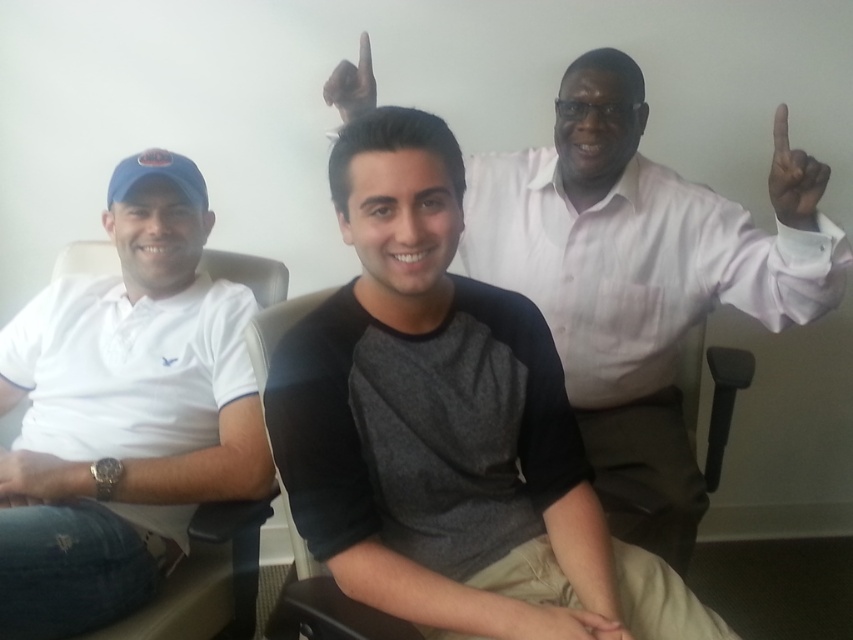
Question: Estimate the real-world distances between objects in this image. Which object is farther from the dark gray cotton shirt at center?

Choices:
 (A) white cotton polo shirt at left
 (B) black matte hand at upper right

Answer: (A)

Question: Is white cotton polo shirt at left to the left of black matte hand at upper right from the viewer's perspective?

Choices:
 (A) no
 (B) yes

Answer: (B)

Question: Does dark gray cotton shirt at center have a smaller size compared to black matte hand at upper right?

Choices:
 (A) no
 (B) yes

Answer: (A)

Question: Does white cotton polo shirt at left have a lesser width compared to black matte hand at upper right?

Choices:
 (A) no
 (B) yes

Answer: (A)

Question: Considering the real-world distances, which object is farthest from the black matte hand at upper right?

Choices:
 (A) white cotton polo shirt at left
 (B) dark gray cotton shirt at center

Answer: (A)

Question: Estimate the real-world distances between objects in this image. Which object is farther from the white cotton polo shirt at left?

Choices:
 (A) dark gray cotton shirt at center
 (B) black matte hand at upper right

Answer: (B)